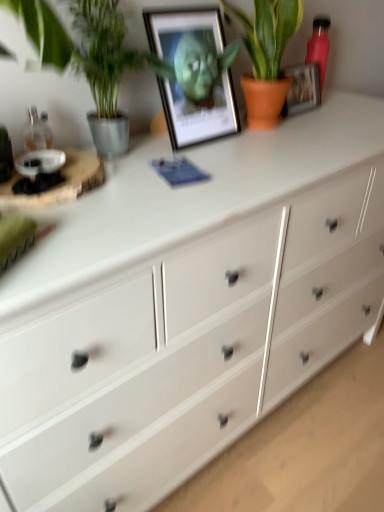
This screenshot has width=384, height=512. Find the location of `vacant area that lies between terracotta pot plant at upper center, which is counted as the 1th houseplant, starting from the right, and metallic framed picture at upper center`. vacant area that lies between terracotta pot plant at upper center, which is counted as the 1th houseplant, starting from the right, and metallic framed picture at upper center is located at coordinates tap(221, 142).